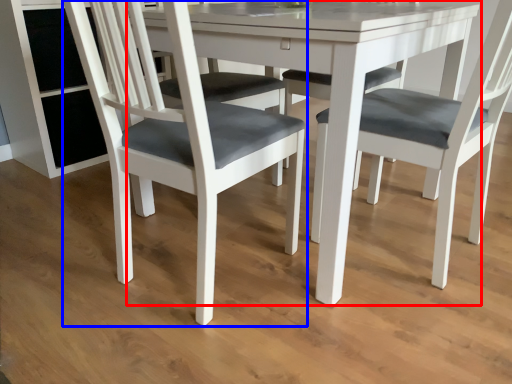
Question: Which of the following is the closest to the observer, round table (highlighted by a red box) or chair (highlighted by a blue box)?

Choices:
 (A) round table
 (B) chair

Answer: (B)